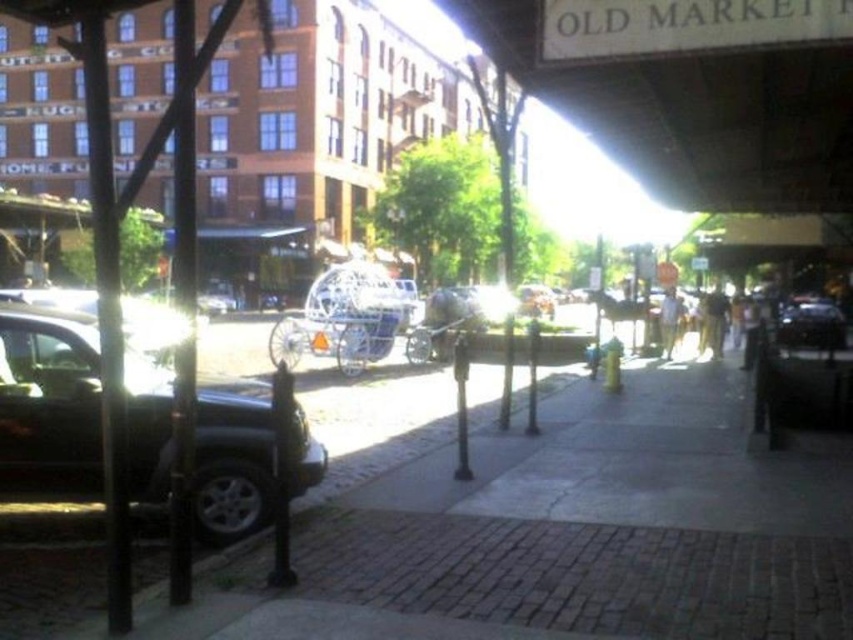
You are a delivery person trying to navigate through the narrow alleyway between the wooden signboard at upper center and the shiny black car at right. Can you pass through without tilting your delivery cart sideways?

The wooden signboard at upper center is much taller than the shiny black car at right, so the height clearance is sufficient for the delivery cart to pass through without tilting sideways.

Consider the image. You are a delivery person trying to read a sign from the sidewalk. The wooden signboard at upper center and the shiny black car at left are both in your line of sight. Which object is wider from your perspective?

The wooden signboard at upper center is wider than the shiny black car at left.

You are a delivery person trying to read the wooden signboard at upper center but the shiny black car at left is blocking your view. Can you see the signboard clearly?

The wooden signboard at upper center is shorter than the shiny black car at left, so the car is taller and may block the view of the signboard.